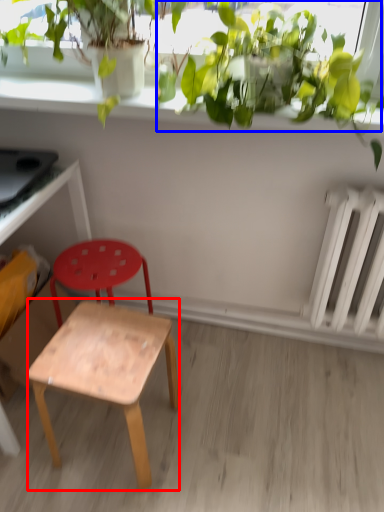
Question: Among these objects, which one is farthest to the camera, stool (highlighted by a red box) or vegetation (highlighted by a blue box)?

Choices:
 (A) stool
 (B) vegetation

Answer: (A)